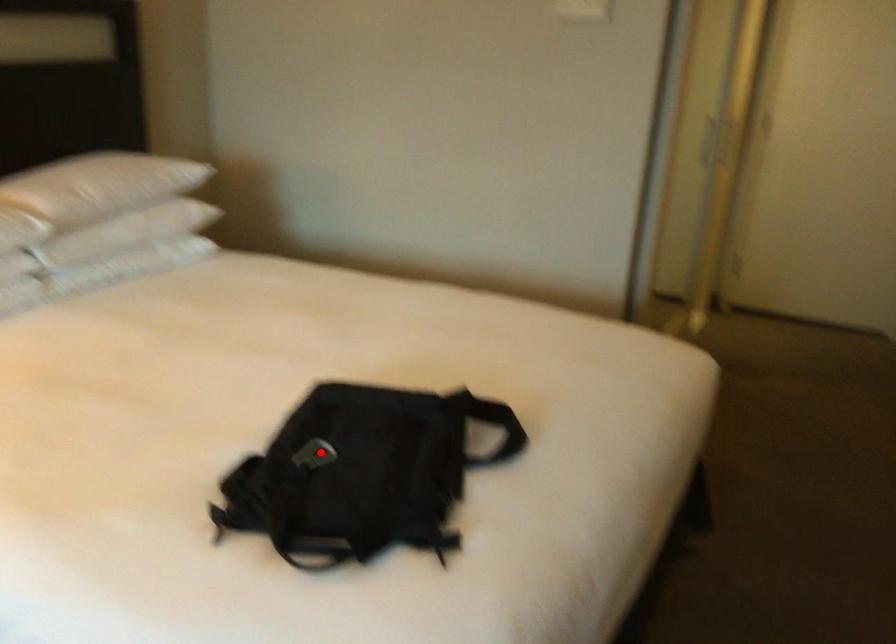
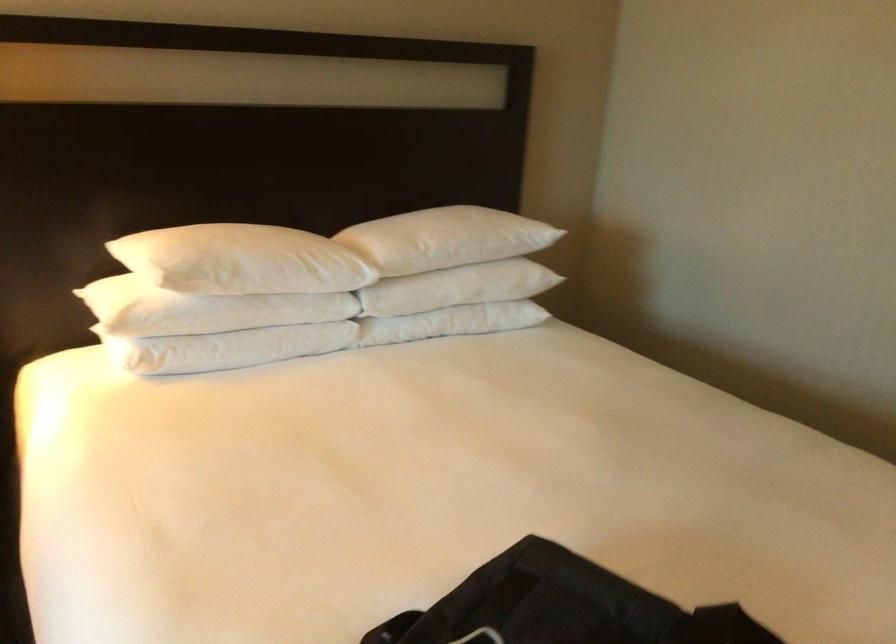
The point at the highlighted location is marked in the first image. Where is the corresponding point in the second image?

(480, 637)